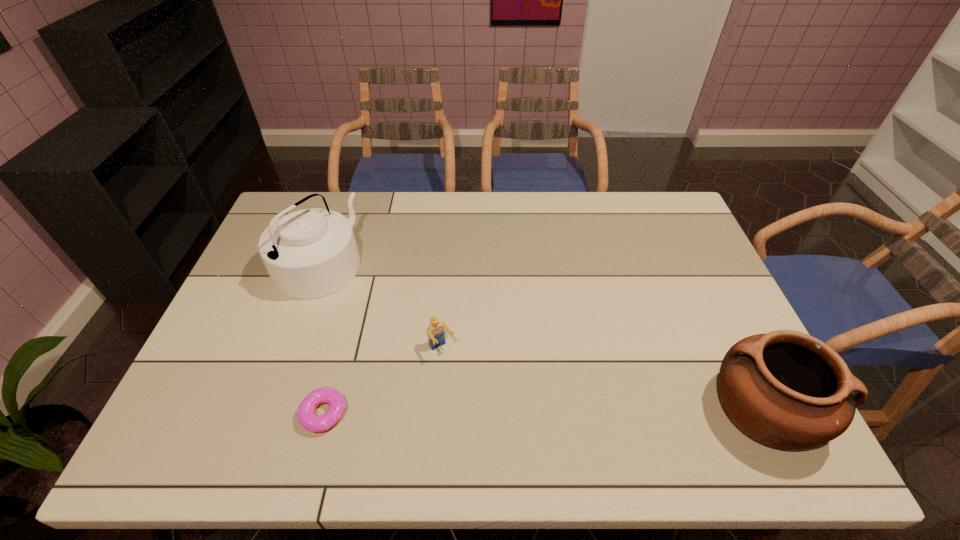
This screenshot has height=540, width=960. I want to click on vacant spot on the desktop that is between the doughnut and the second tallest object and is positioned on the spout of the kettle, so click(561, 410).

This screenshot has height=540, width=960. Identify the location of free space on the desktop that is between the doughnut and the third shortest object and is positioned on the face of the Lego. (487, 411).